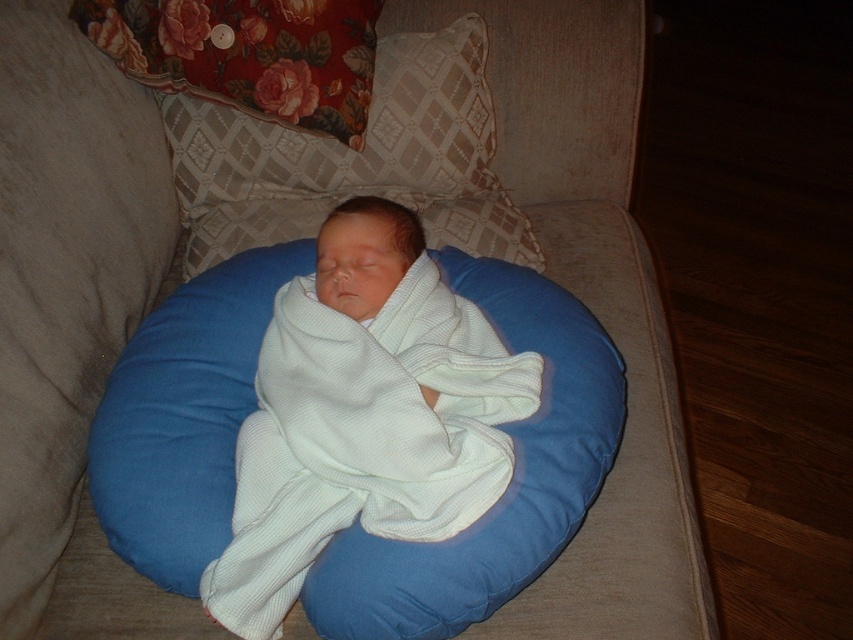
You are a GUI agent. You are given a task and a screenshot of the screen. Output one action in this format:
    pyautogui.click(x=<x>, y=<y>)
    Task: Click on the white waffle fabric newborn at center
    The width and height of the screenshot is (853, 640).
    Given the screenshot: What is the action you would take?
    pyautogui.click(x=364, y=413)

Between white waffle fabric newborn at center and white soft pillow at center, which one appears on the left side from the viewer's perspective?

white soft pillow at center

Image resolution: width=853 pixels, height=640 pixels. Identify the location of white waffle fabric newborn at center. (364, 413).